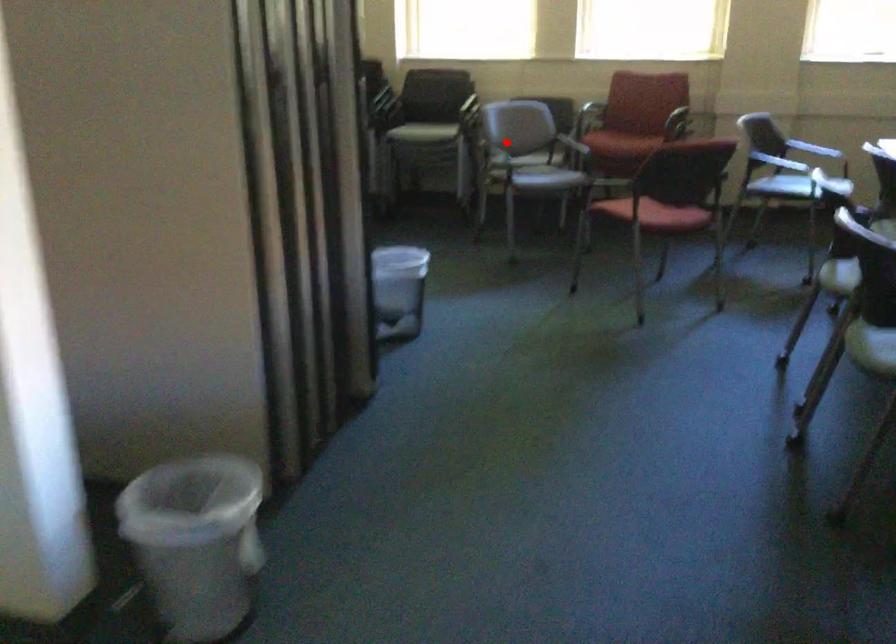
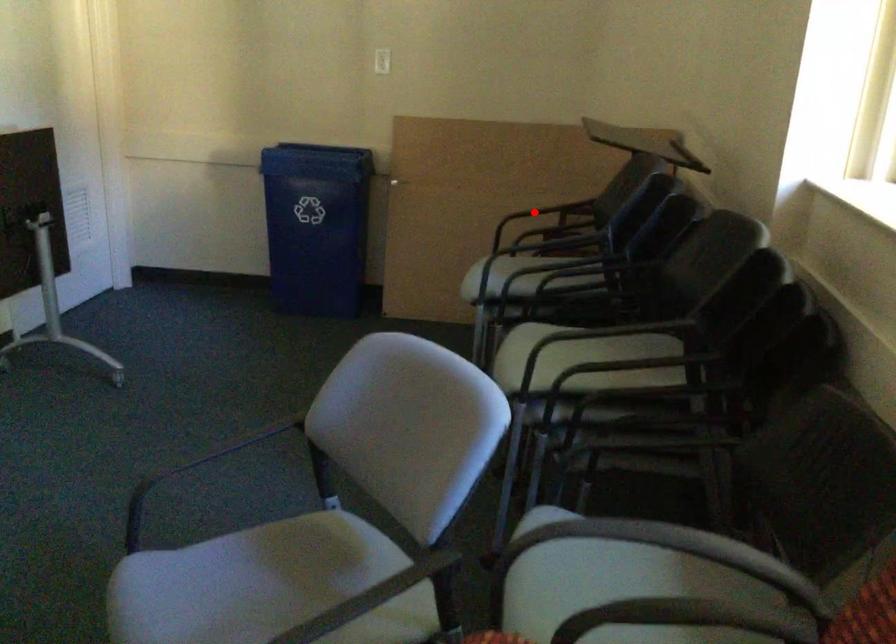
I am providing you with two images of the same scene from different viewpoints. A red point is marked on the first image and another point is marked on the second image. Are the points marked in image1 and image2 representing the same 3D position?

No